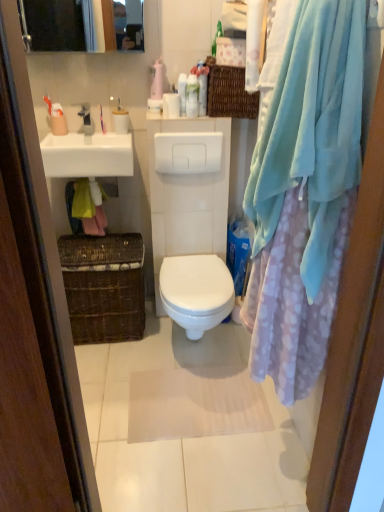
The height and width of the screenshot is (512, 384). I want to click on free space above white glossy toilet at center (from a real-world perspective), so click(x=193, y=271).